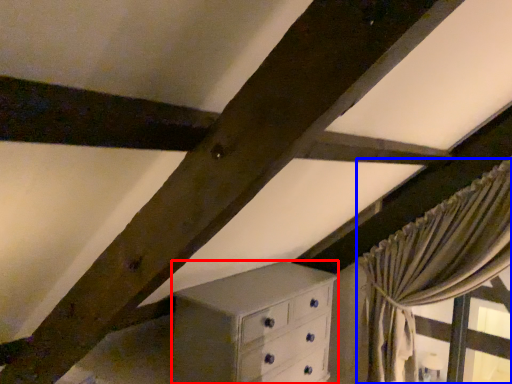
Question: Which point is closer to the camera, chest of drawers (highlighted by a red box) or curtain (highlighted by a blue box)?

Choices:
 (A) chest of drawers
 (B) curtain

Answer: (A)